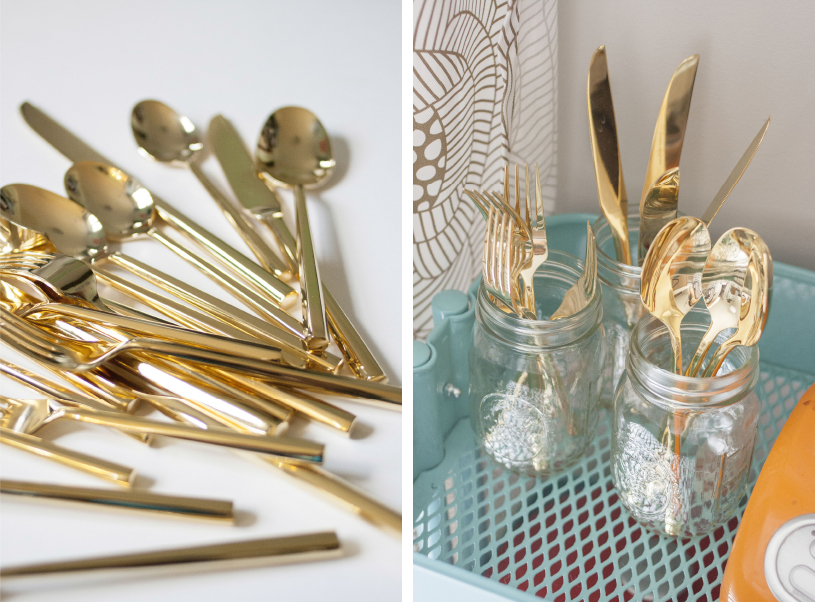
Identify the location of fork. (15, 414), (12, 344), (32, 265), (501, 259), (489, 201), (526, 186), (588, 283).